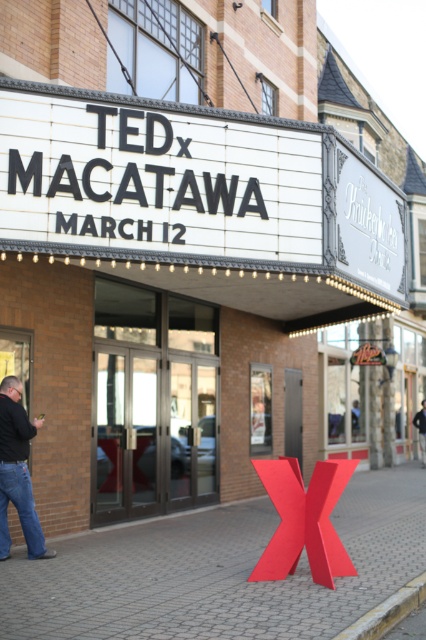
You are standing in front of the building and notice the matte red x at center and the dark blue jeans at center. Which object is positioned higher up in the scene?

The matte red x at center is located above dark blue jeans at center, so the matte red x at center is positioned higher up in the scene.

You are standing in front of the building and want to take a photo of the matte red x at center without including the dark blue jeans at lower left in the frame. Based on their positions, is this possible?

The matte red x at center is below dark blue jeans at lower left, so if you position yourself to exclude the lower left area where the dark blue jeans at lower left are located, you can capture the matte red x at center without including them in the photo.